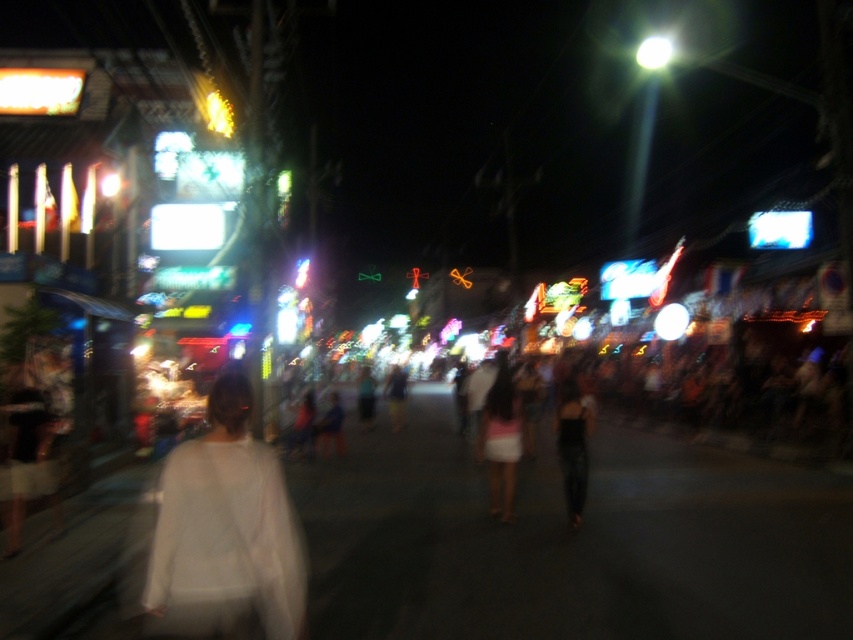
Is white matte shirt at center in front of pink fabric skirt at center?

Yes, it is in front of pink fabric skirt at center.

Can you confirm if white matte shirt at center is wider than pink fabric skirt at center?

In fact, white matte shirt at center might be narrower than pink fabric skirt at center.

Between point (148, 625) and point (508, 468), which one is positioned in front?

Point (148, 625)

You are a GUI agent. You are given a task and a screenshot of the screen. Output one action in this format:
    pyautogui.click(x=<x>, y=<y>)
    Task: Click on the white matte shirt at center
    The image size is (853, 640).
    Given the screenshot: What is the action you would take?
    pyautogui.click(x=225, y=532)

How distant is pink fabric skirt at center from matte black dress at center?

7.43 feet

Is pink fabric skirt at center smaller than matte black dress at center?

No, pink fabric skirt at center is not smaller than matte black dress at center.

Does point (508, 509) come farther from viewer compared to point (581, 484)?

Yes.

Find the location of `pink fabric skirt at center`. pink fabric skirt at center is located at coordinates (502, 440).

Can you confirm if white matte shirt at center is positioned above matte black dress at center?

Correct, white matte shirt at center is located above matte black dress at center.

Is white matte shirt at center wider than matte black dress at center?

Correct, the width of white matte shirt at center exceeds that of matte black dress at center.

What do you see at coordinates (225, 532) in the screenshot?
I see `white matte shirt at center` at bounding box center [225, 532].

Locate an element on the screen. The height and width of the screenshot is (640, 853). white matte shirt at center is located at coordinates (225, 532).